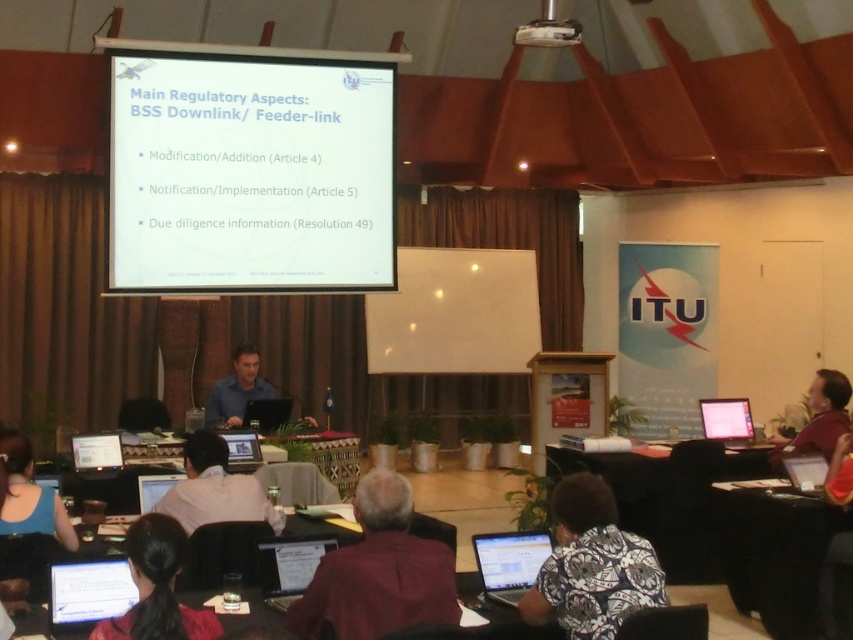
You are an event organizer who needs to ensure social distancing between participants. The minimum required distance is 6 feet. Are the two people wearing the black floral shirt at lower center and the white shirt at center maintaining the required distance?

The black floral shirt at lower center and white shirt at center are 6.17 feet apart, which exceeds the minimum required distance of 6 feet, so they are maintaining the required social distancing.

You are an attendee at the conference and want to take a photo of the white glossy projector screen at upper center and the blue fabric shirt at lower left. Which object should you focus on first if you want to capture both in one frame without moving the camera?

You should focus on the white glossy projector screen at upper center first because it is larger in size compared to the blue fabric shirt at lower left, allowing it to be more prominent in the frame.

You are organizing a presentation and need to place a 1.2 meter wide banner between the white shirt at center and the dark red shirt at lower right. Based on their positions, do you think there is enough space for the banner?

The white shirt at center might be wider than dark red shirt at lower right, but without exact measurements of the distance between them, it is uncertain if the 1.2 meter banner will fit. Consider measuring the actual space before placing the banner.